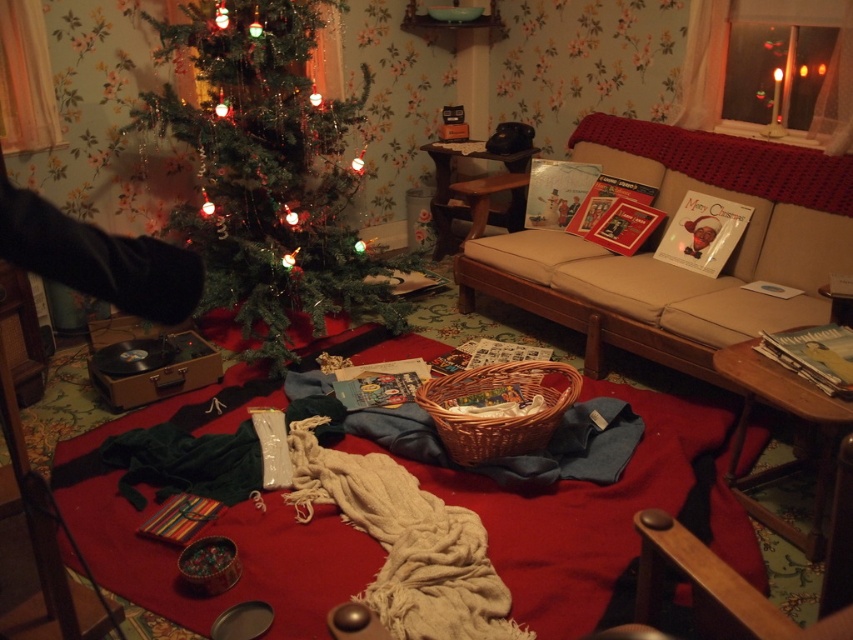
Who is positioned more to the left, green matte christmas tree at center or beige fabric couch at center?

Positioned to the left is green matte christmas tree at center.

Is point (248, 339) in front of point (575, 157)?

Yes, it is.

Locate an element on the screen. green matte christmas tree at center is located at coordinates (270, 173).

Can you confirm if green matte christmas tree at center is positioned below woven brown basket at center?

Actually, green matte christmas tree at center is above woven brown basket at center.

Does green matte christmas tree at center come in front of woven brown basket at center?

That is False.

Describe the element at coordinates (270, 173) in the screenshot. I see `green matte christmas tree at center` at that location.

Locate an element on the screen. This screenshot has width=853, height=640. green matte christmas tree at center is located at coordinates (270, 173).

Between beige fabric couch at center and woven brown basket at center, which one is positioned higher?

Positioned higher is beige fabric couch at center.

Between beige fabric couch at center and woven brown basket at center, which one has more height?

With more height is beige fabric couch at center.

The height and width of the screenshot is (640, 853). Describe the element at coordinates (670, 264) in the screenshot. I see `beige fabric couch at center` at that location.

I want to click on beige fabric couch at center, so click(670, 264).